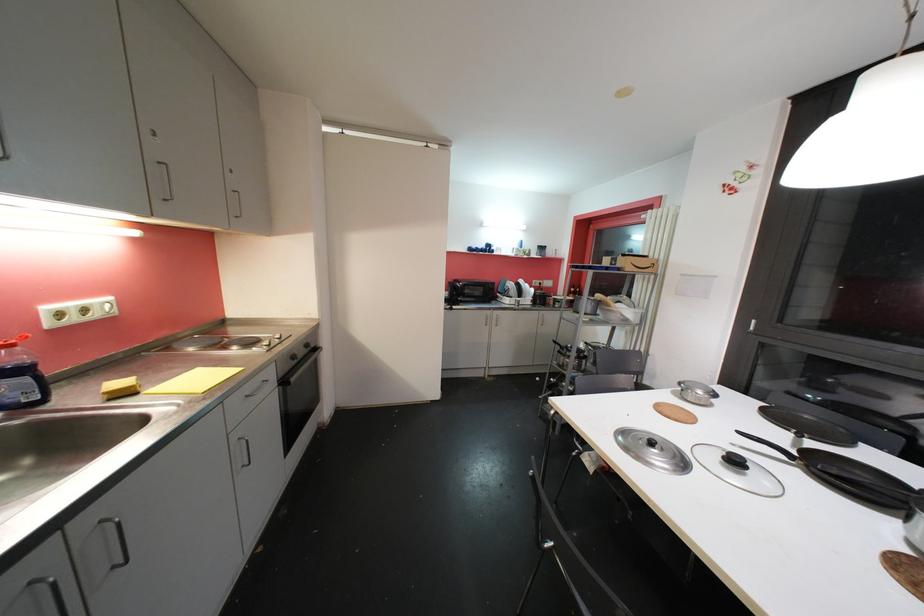
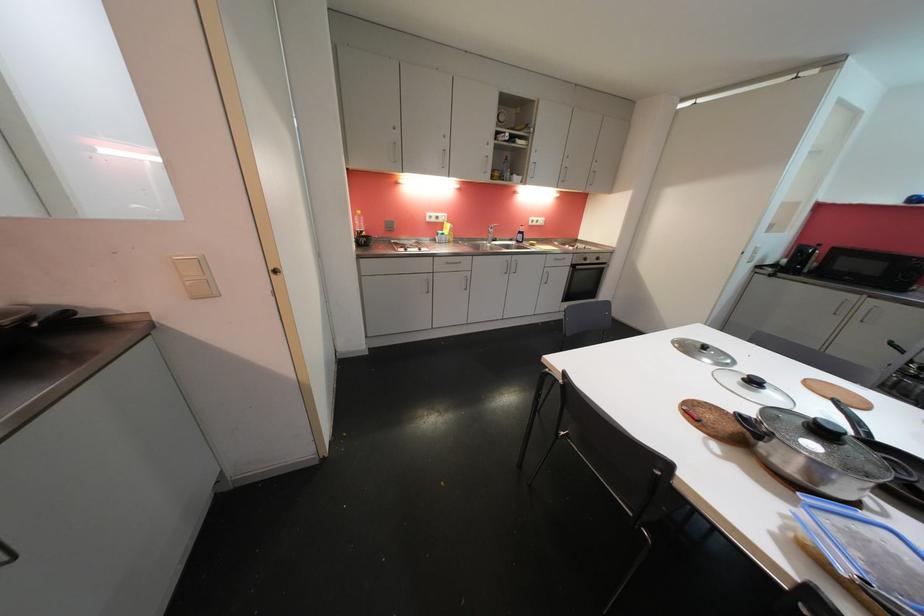
In the second image, find the point that corresponds to point (298, 360) in the first image.

(590, 262)